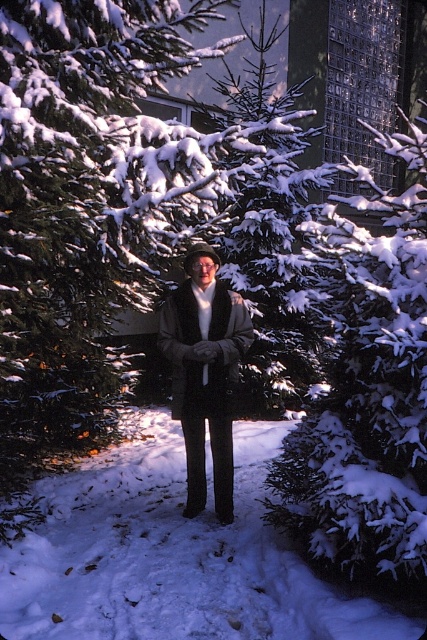
Question: Which of the following is the farthest from the observer?

Choices:
 (A) (213, 262)
 (B) (237, 444)
 (C) (365, 300)

Answer: (B)

Question: Which point is closer to the camera?

Choices:
 (A) dark gray wool coat at center
 (B) snow-covered evergreen at center

Answer: (B)

Question: Is white fluffy snow at center below snow-covered evergreen at center?

Choices:
 (A) no
 (B) yes

Answer: (B)

Question: Considering the real-world distances, which object is closest to the snow-covered evergreen at center?

Choices:
 (A) dark gray wool coat at center
 (B) white fluffy snow at center

Answer: (A)

Question: Can you confirm if snow-covered evergreen at center is positioned to the left of dark gray wool coat at center?

Choices:
 (A) no
 (B) yes

Answer: (A)

Question: Does white fluffy snow at center appear under dark gray wool coat at center?

Choices:
 (A) yes
 (B) no

Answer: (A)